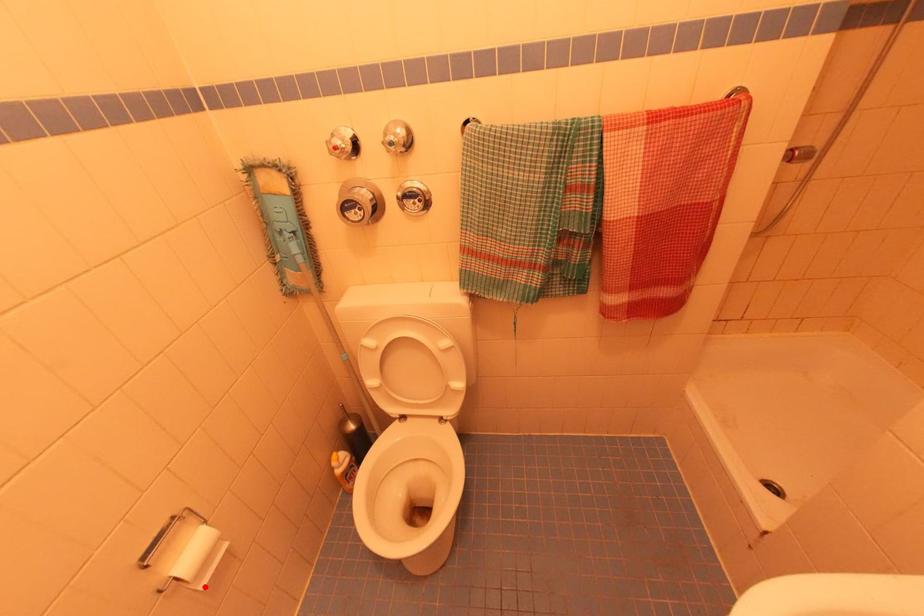
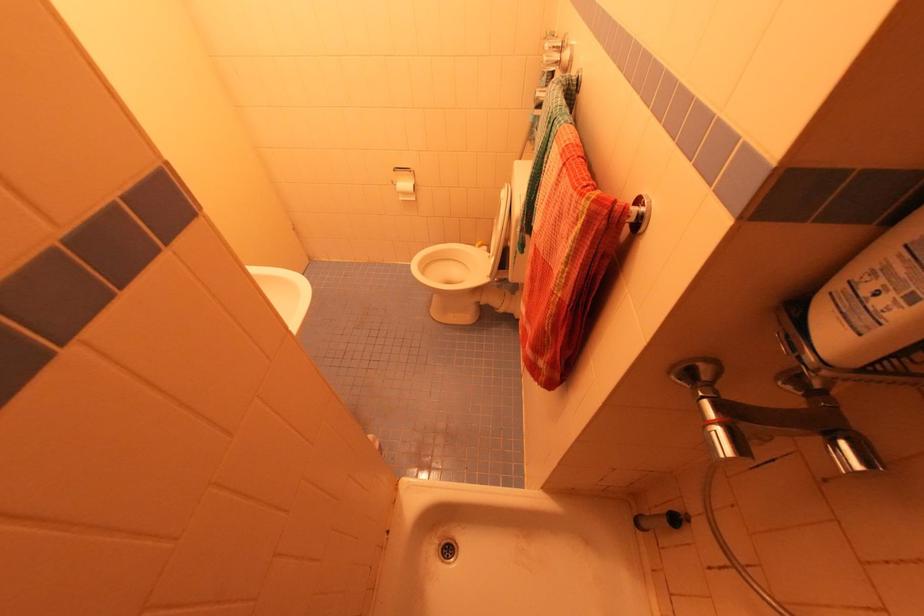
Locate, in the second image, the point that corresponds to the highlighted location in the first image.

(403, 200)